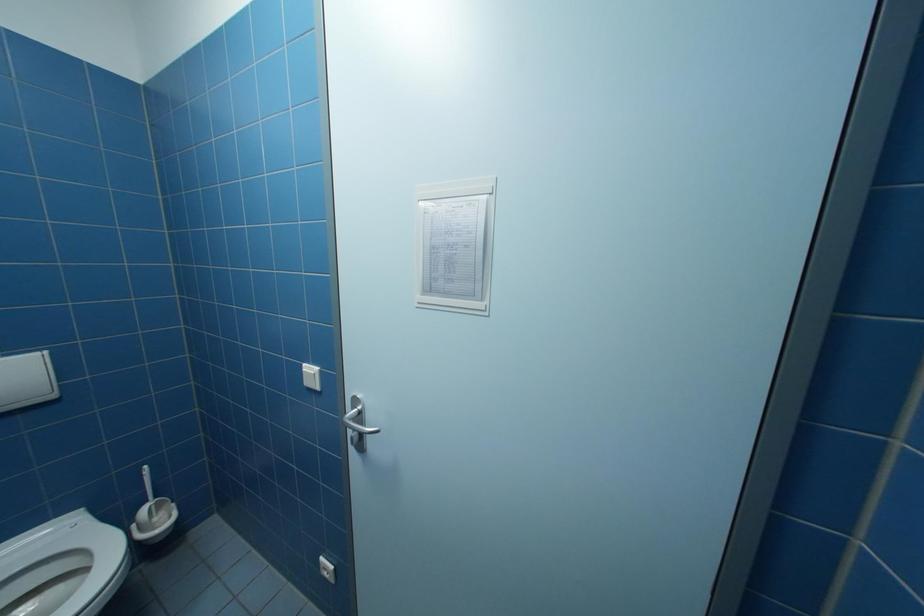
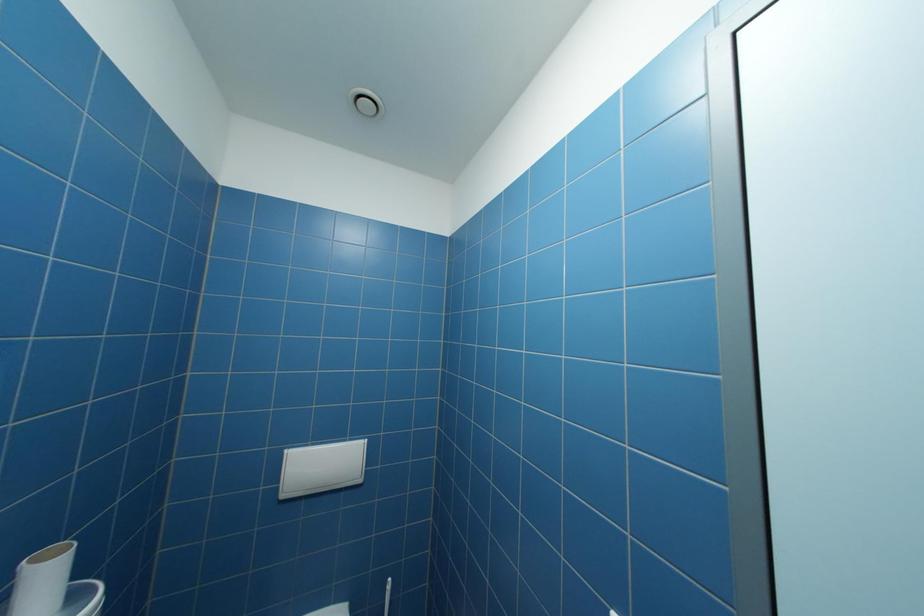
In the scene shown: First-person continuous shooting, in which direction is the camera rotating?

The rotation direction of the camera is left-up.